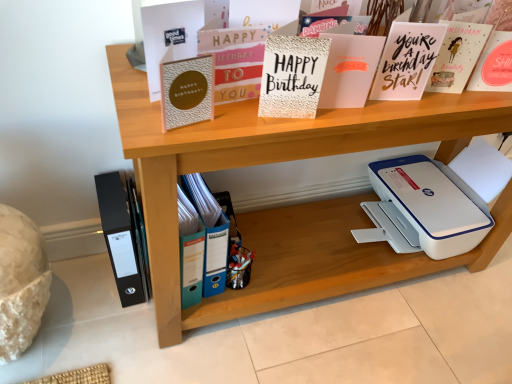
In order to click on vacant area located to the right-hand side of matte gold card at center, which is the 3th paperback book in right-to-left order in this screenshot , I will do [x=400, y=110].